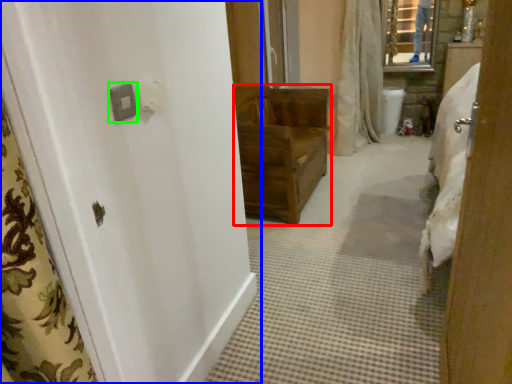
Question: Considering the real-world distances, which object is farthest from furniture (highlighted by a red box)? door (highlighted by a blue box) or light switch (highlighted by a green box)?

Choices:
 (A) door
 (B) light switch

Answer: (B)